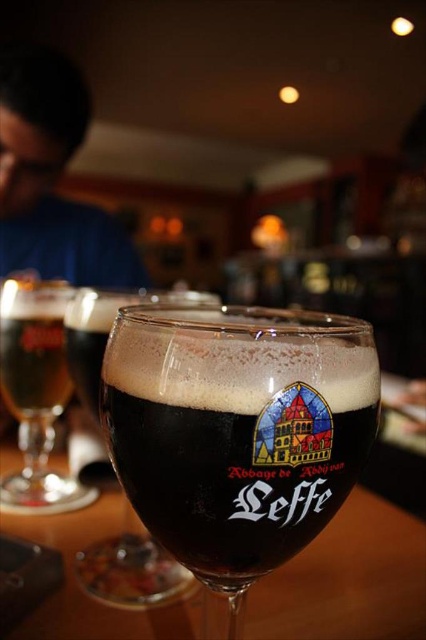
Does dark brown glass at left have a larger size compared to translucent amber glass at left?

Indeed, dark brown glass at left has a larger size compared to translucent amber glass at left.

Is point (40, 369) positioned before point (32, 403)?

Yes, point (40, 369) is in front of point (32, 403).

Identify the location of dark brown glass at left. This screenshot has width=426, height=640. (36, 394).

This screenshot has height=640, width=426. What do you see at coordinates (238, 429) in the screenshot?
I see `dark glass leffe beer at center` at bounding box center [238, 429].

Can you confirm if dark glass leffe beer at center is smaller than blue fabric shirt at upper left?

Indeed, dark glass leffe beer at center has a smaller size compared to blue fabric shirt at upper left.

Is point (317, 385) in front of point (112, 221)?

Yes, point (317, 385) is in front of point (112, 221).

Where is `dark glass leffe beer at center`? dark glass leffe beer at center is located at coordinates (238, 429).

Between point (2, 216) and point (58, 401), which one is positioned behind?

The point (2, 216) is more distant.

Identify the location of blue fabric shirt at upper left. (51, 177).